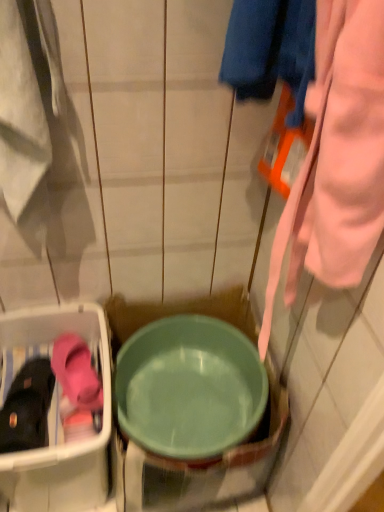
Question: Considering the relative positions of matte pink slipper at lower left and green plastic basin at center in the image provided, is matte pink slipper at lower left to the left or to the right of green plastic basin at center?

Choices:
 (A) left
 (B) right

Answer: (A)

Question: Looking at the image, does matte pink slipper at lower left seem bigger or smaller compared to green plastic basin at center?

Choices:
 (A) big
 (B) small

Answer: (B)

Question: Considering the positions of point (28, 362) and point (230, 355), is point (28, 362) closer or farther from the camera than point (230, 355)?

Choices:
 (A) closer
 (B) farther

Answer: (A)

Question: Considering the relative positions of green plastic basin at center and matte pink slipper at lower left in the image provided, is green plastic basin at center to the left or to the right of matte pink slipper at lower left?

Choices:
 (A) right
 (B) left

Answer: (A)

Question: From the image's perspective, is green plastic basin at center located above or below matte pink slipper at lower left?

Choices:
 (A) below
 (B) above

Answer: (A)

Question: Is green plastic basin at center bigger or smaller than matte pink slipper at lower left?

Choices:
 (A) big
 (B) small

Answer: (A)

Question: Does point (163, 426) appear closer or farther from the camera than point (36, 436)?

Choices:
 (A) closer
 (B) farther

Answer: (B)